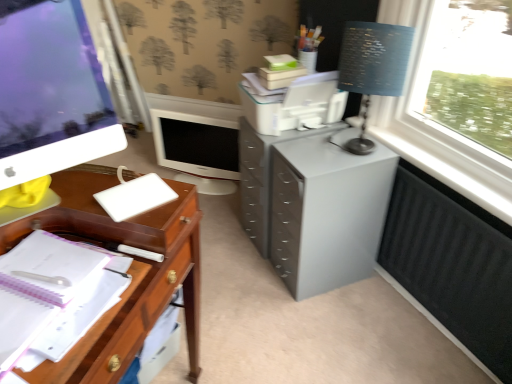
Question: Can you confirm if white plastic pen at left is positioned to the right of black matte radiator at lower right?

Choices:
 (A) no
 (B) yes

Answer: (A)

Question: Considering the relative sizes of white plastic pen at left and black matte radiator at lower right in the image provided, is white plastic pen at left bigger than black matte radiator at lower right?

Choices:
 (A) no
 (B) yes

Answer: (B)

Question: Is the position of white plastic pen at left less distant than that of black matte radiator at lower right?

Choices:
 (A) yes
 (B) no

Answer: (A)

Question: Is white plastic pen at left far away from black matte radiator at lower right?

Choices:
 (A) no
 (B) yes

Answer: (B)

Question: Could you tell me if white plastic pen at left is facing black matte radiator at lower right?

Choices:
 (A) no
 (B) yes

Answer: (A)

Question: Is white plastic pen at left not within black matte radiator at lower right?

Choices:
 (A) no
 (B) yes

Answer: (B)

Question: Does black matte radiator at lower right have a lesser height compared to white glossy computer monitor at left, placed as the 1th computer monitor when sorted from front to back?

Choices:
 (A) yes
 (B) no

Answer: (A)

Question: Considering the relative sizes of black matte radiator at lower right and white glossy computer monitor at left, placed as the 1th computer monitor when sorted from front to back, in the image provided, is black matte radiator at lower right smaller than white glossy computer monitor at left, placed as the 1th computer monitor when sorted from front to back,?

Choices:
 (A) yes
 (B) no

Answer: (A)

Question: From the image's perspective, is black matte radiator at lower right above white glossy computer monitor at left, placed as the 1th computer monitor when sorted from front to back?

Choices:
 (A) no
 (B) yes

Answer: (A)

Question: From the image's perspective, is black matte radiator at lower right below white glossy computer monitor at left, acting as the second computer monitor starting from the back?

Choices:
 (A) no
 (B) yes

Answer: (B)

Question: Does black matte radiator at lower right appear on the right side of white glossy computer monitor at left, placed as the 1th computer monitor when sorted from front to back?

Choices:
 (A) no
 (B) yes

Answer: (B)

Question: Is white glossy computer monitor at left, placed as the 1th computer monitor when sorted from front to back, at the back of black matte radiator at lower right?

Choices:
 (A) yes
 (B) no

Answer: (B)

Question: From a real-world perspective, is white glossy computer monitor at center, the second computer monitor positioned from the front, physically above white plastic pen at left?

Choices:
 (A) no
 (B) yes

Answer: (A)